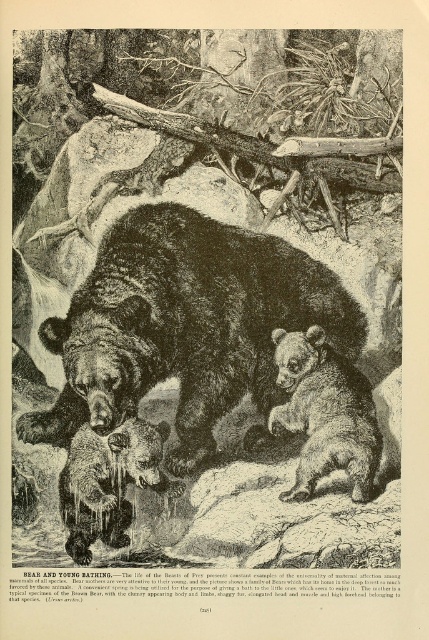
Looking at this image, you are an observer looking at the image of the bears. There are two points marked in the image. The first point is at coordinates point (x=123, y=388) and the second point is at point (x=308, y=403). Which of these two points is nearer to you?

Point (x=123, y=388) is closer to the camera than point (x=308, y=403).